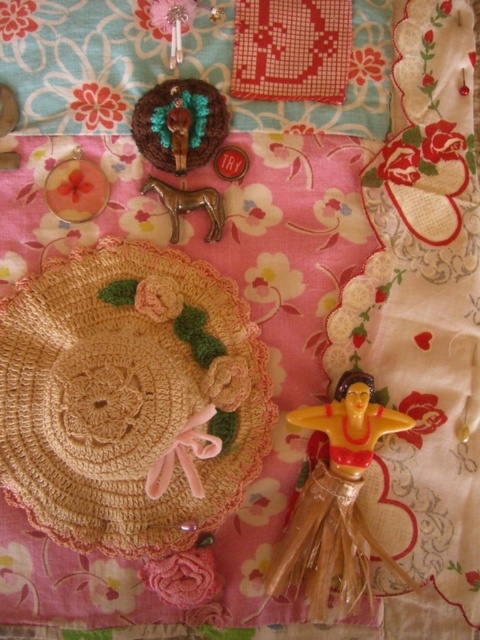
Question: Which point is closer to the camera?

Choices:
 (A) turquoise felt brooch at upper center
 (B) metallic gold horse at center
 (C) yellow plastic barbie at lower right

Answer: (C)

Question: Is yellow plastic barbie at lower right to the left of turquoise felt brooch at upper center from the viewer's perspective?

Choices:
 (A) yes
 (B) no

Answer: (B)

Question: Which of the following is the farthest from the observer?

Choices:
 (A) turquoise felt brooch at upper center
 (B) metallic gold horse at center

Answer: (B)

Question: Is yellow plastic barbie at lower right positioned before turquoise felt brooch at upper center?

Choices:
 (A) yes
 (B) no

Answer: (A)

Question: Does yellow plastic barbie at lower right appear under metallic gold horse at center?

Choices:
 (A) no
 (B) yes

Answer: (B)

Question: Which point is closer to the camera taking this photo?

Choices:
 (A) (183, 104)
 (B) (210, 195)
 (C) (347, 556)

Answer: (C)